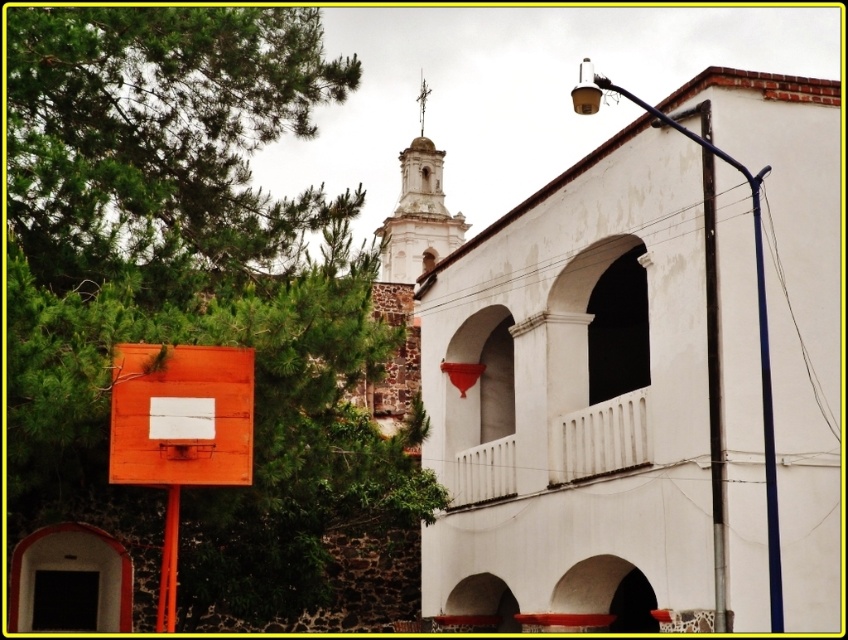
You are standing in front of the white building with arched windows and a balcony. You see a green leafy tree at upper left and an orange matte basketball backboard at left. Which object is positioned to the right of the other?

The green leafy tree at upper left is positioned to the right of the orange matte basketball backboard at left.

You are a painter planning to paint the scene. You want to emphasize the contrast between the green leafy tree at upper left and the orange matte basketball backboard at left. Which object should you make larger in your painting to highlight their size difference?

The green leafy tree at upper left should be painted larger than the orange matte basketball backboard at left to emphasize their size difference, as the green leafy tree at upper left is larger in size than the orange matte basketball backboard at left according to the description.